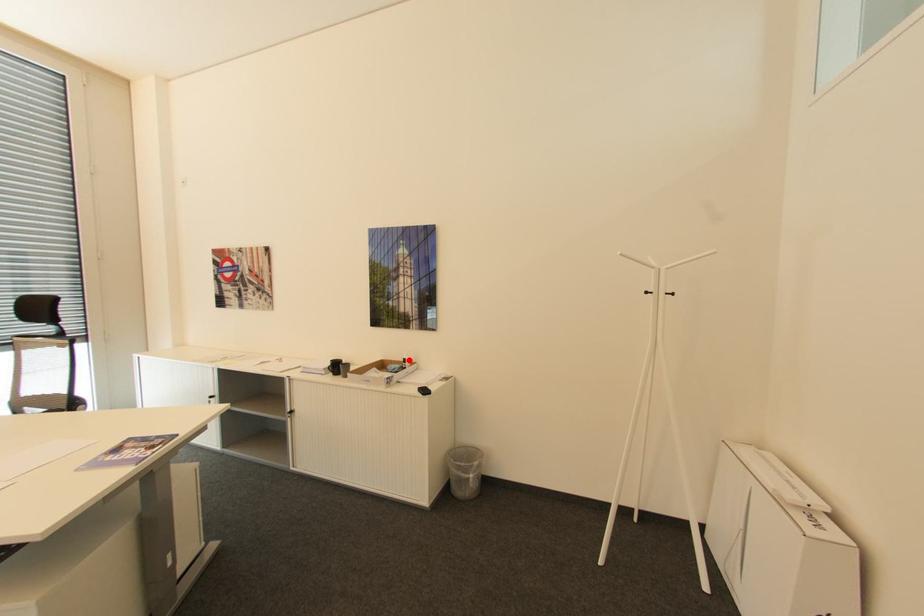
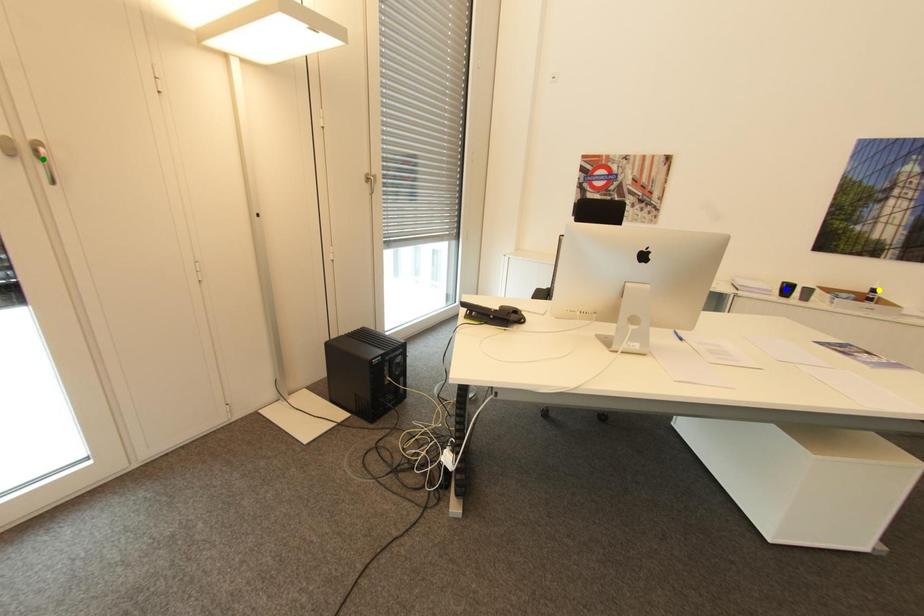
Question: I am providing you with two images of the same scene from different viewpoints. A red point is marked on the first image. You are given multiple points on the second image. Can you choose the point in image 2 that corresponds to the point in image 1?

Choices:
 (A) green point
 (B) blue point
 (C) yellow point

Answer: (C)